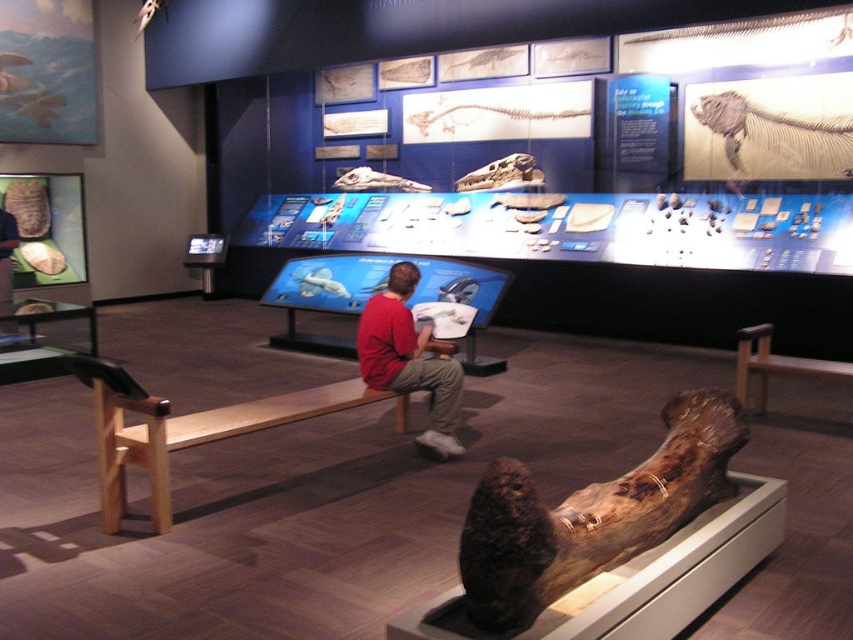
Looking at this image, who is more distant from viewer, (543, 608) or (223, 433)?

The point (223, 433) is more distant.

Describe the element at coordinates (590, 515) in the screenshot. The height and width of the screenshot is (640, 853). I see `brown wood log at lower right` at that location.

Between point (492, 481) and point (404, 410), which one is positioned in front?

Point (492, 481) is more forward.

Locate an element on the screen. brown wood log at lower right is located at coordinates (590, 515).

Who is more distant from viewer, (103,476) or (432,360)?

Positioned behind is point (432,360).

Can you confirm if light brown wood bench at center is positioned to the right of red cotton shirt at center?

No, light brown wood bench at center is not to the right of red cotton shirt at center.

Does point (265, 408) lie in front of point (364, 358)?

That is True.

Image resolution: width=853 pixels, height=640 pixels. I want to click on light brown wood bench at center, so click(x=189, y=428).

Does brown wood log at lower right have a greater height compared to red cotton shirt at center?

Incorrect, brown wood log at lower right's height is not larger of red cotton shirt at center's.

Who is more distant from viewer, (717, 392) or (402, 352)?

Positioned behind is point (402, 352).

Where is `brown wood log at lower right`? The image size is (853, 640). brown wood log at lower right is located at coordinates (590, 515).